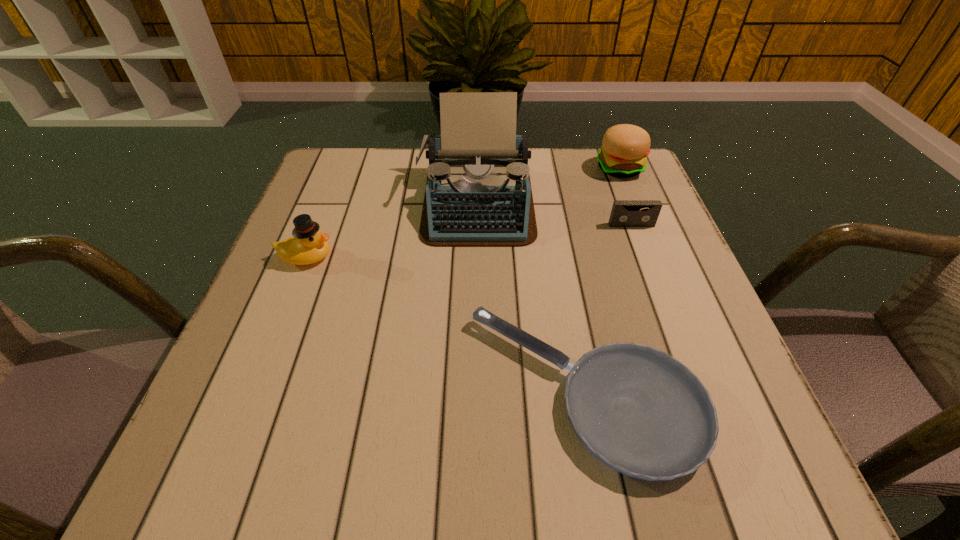
Image resolution: width=960 pixels, height=540 pixels. I want to click on empty space that is in between the fourth tallest object and the tallest object, so click(x=554, y=214).

Locate an element on the screen. vacant region between the shortest object and the hamburger is located at coordinates 602,280.

Where is `blank region between the videotape and the typewriter`? This screenshot has height=540, width=960. blank region between the videotape and the typewriter is located at coordinates (554, 214).

Where is `unoccupied area between the hamburger and the nearest object`? This screenshot has width=960, height=540. unoccupied area between the hamburger and the nearest object is located at coordinates (602, 280).

Where is `empty space that is in between the hamburger and the tallest object`? The height and width of the screenshot is (540, 960). empty space that is in between the hamburger and the tallest object is located at coordinates (548, 186).

Where is `blank region between the hamburger and the typewriter`? The height and width of the screenshot is (540, 960). blank region between the hamburger and the typewriter is located at coordinates (548, 186).

Identify which object is located as the fourth nearest to the duck. Please provide its 2D coordinates. Your answer should be formatted as a tuple, i.e. [(x, y)], where the tuple contains the x and y coordinates of a point satisfying the conditions above.

[(625, 147)]

Locate an element on the screen. object that is the second nearest to the shortest object is located at coordinates (625, 213).

What are the coordinates of `free space that satisfies the following two spatial constraints: 1. on the typing side of the typewriter; 2. on the front-facing side of the leftmost object` in the screenshot? It's located at (476, 257).

I want to click on free space that satisfies the following two spatial constraints: 1. on the front side of the hamburger; 2. on the front-facing side of the duck, so click(656, 257).